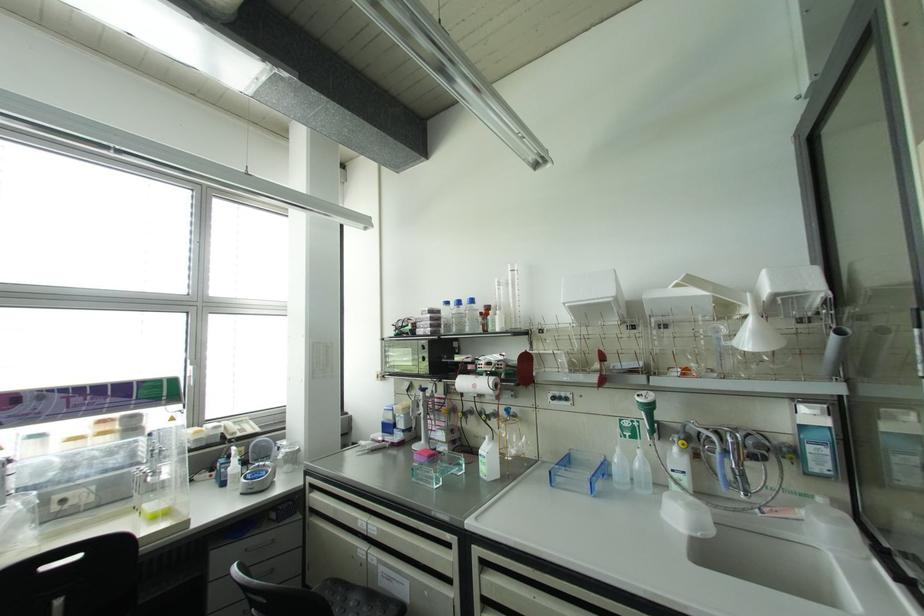
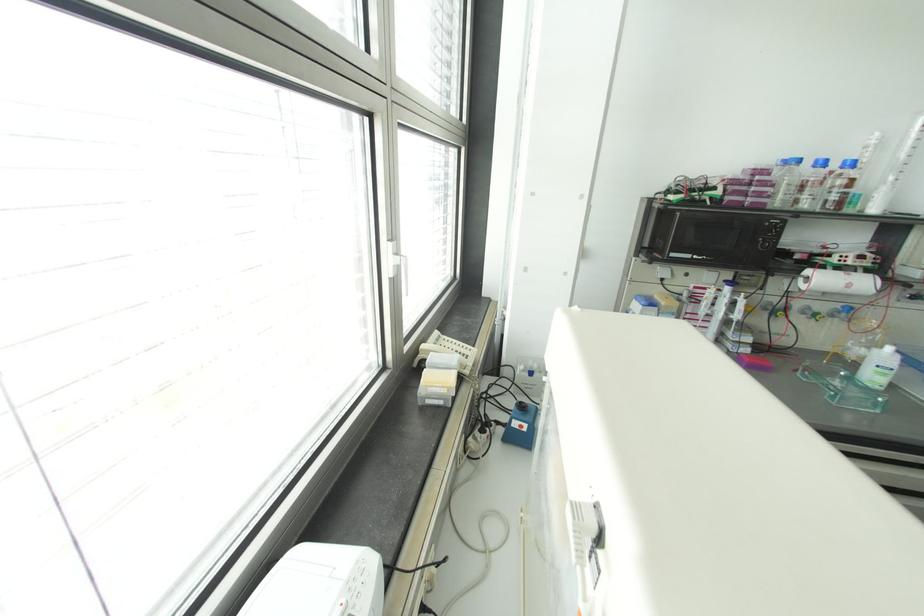
Locate, in the second image, the point that corresponds to point 491,445 in the first image.

(898, 355)